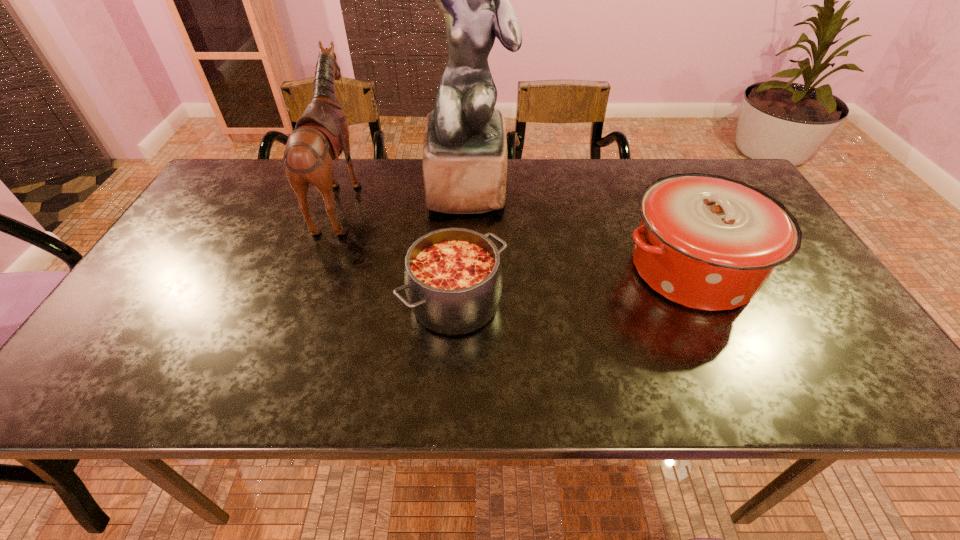
The height and width of the screenshot is (540, 960). I want to click on free space that is in between the sculpture and the taller casserole, so click(581, 228).

Where is `free spot between the saddle and the shorter casserole`? Image resolution: width=960 pixels, height=540 pixels. free spot between the saddle and the shorter casserole is located at coordinates (398, 250).

Find the location of a particular element. This screenshot has width=960, height=540. vacant point located between the saddle and the rightmost object is located at coordinates (517, 233).

This screenshot has width=960, height=540. In order to click on free space between the sculpture and the right casserole in this screenshot , I will do `click(581, 228)`.

Identify the location of free space between the leftmost object and the shorter casserole. The height and width of the screenshot is (540, 960). (398, 250).

This screenshot has width=960, height=540. Identify the location of vacant space that is in between the rightmost object and the left casserole. tap(573, 287).

Identify the location of the closest object to the tallest object. Image resolution: width=960 pixels, height=540 pixels. pos(321,134).

Select which object is the closest to the tallest object. Please provide its 2D coordinates. Your answer should be formatted as a tuple, i.e. [(x, y)], where the tuple contains the x and y coordinates of a point satisfying the conditions above.

[(321, 134)]

Find the location of a particular element. The width and height of the screenshot is (960, 540). free space that satisfies the following two spatial constraints: 1. on the back of the shorter casserole; 2. on the right side of the saddle is located at coordinates (303, 303).

The width and height of the screenshot is (960, 540). I want to click on vacant space that satisfies the following two spatial constraints: 1. on the back side of the left casserole; 2. on the back of the leftmost object, so click(461, 197).